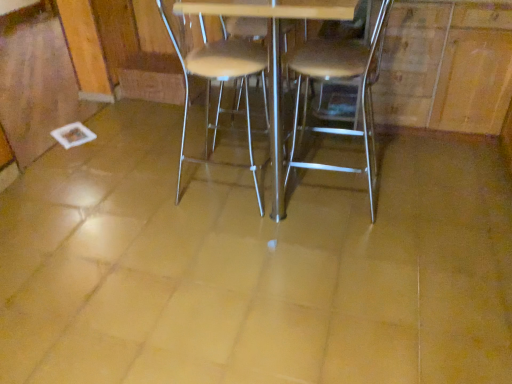
This screenshot has height=384, width=512. Find the location of `free area in between metallic silver chair at center, which appears as the first chair when viewed from the left, and metallic silver table at center`. free area in between metallic silver chair at center, which appears as the first chair when viewed from the left, and metallic silver table at center is located at coordinates (231, 157).